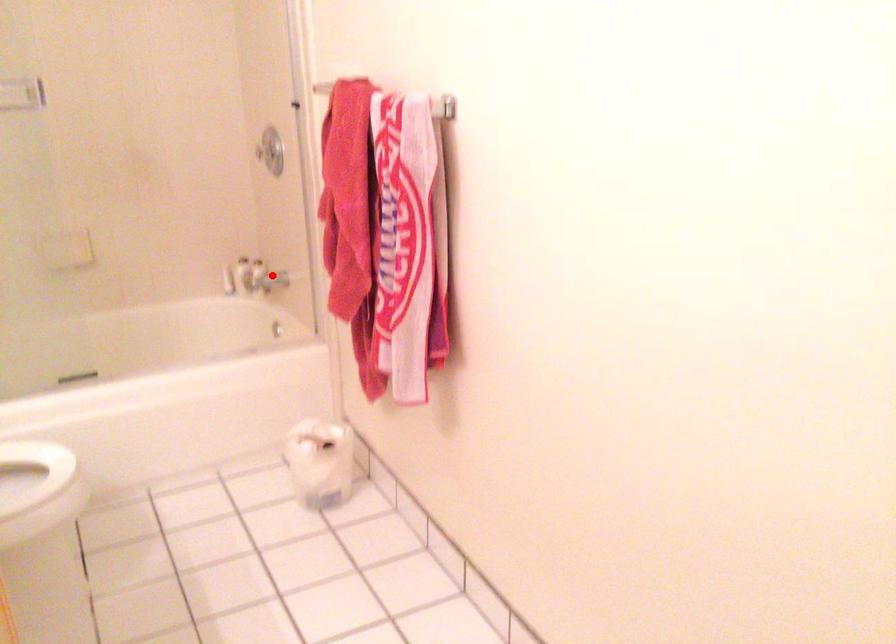
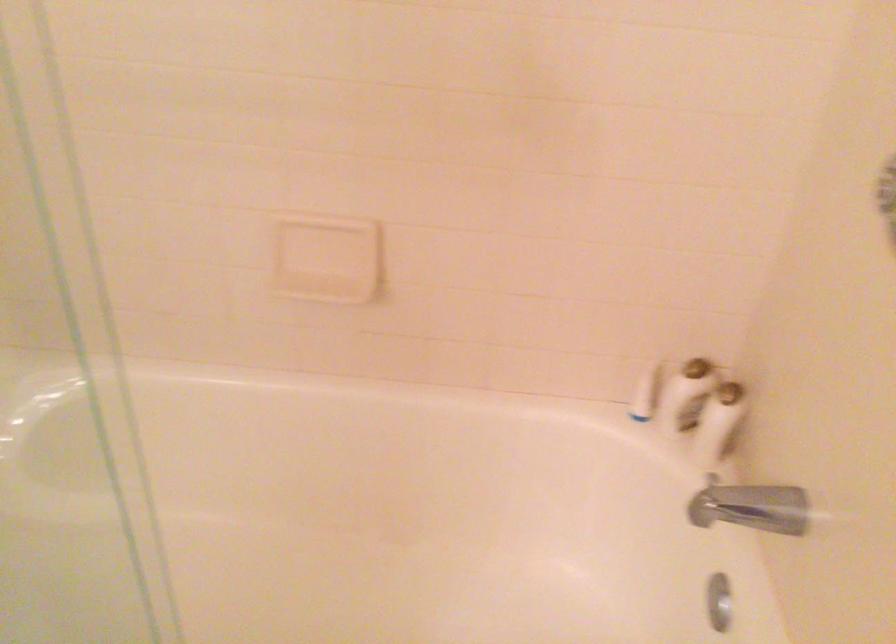
Question: I am providing you with two images of the same scene from different viewpoints. Image1 has a red point marked. In image2, the corresponding 3D location appears at what relative position? Reply with the corresponding letter.

Choices:
 (A) Closer
 (B) Farther

Answer: (A)